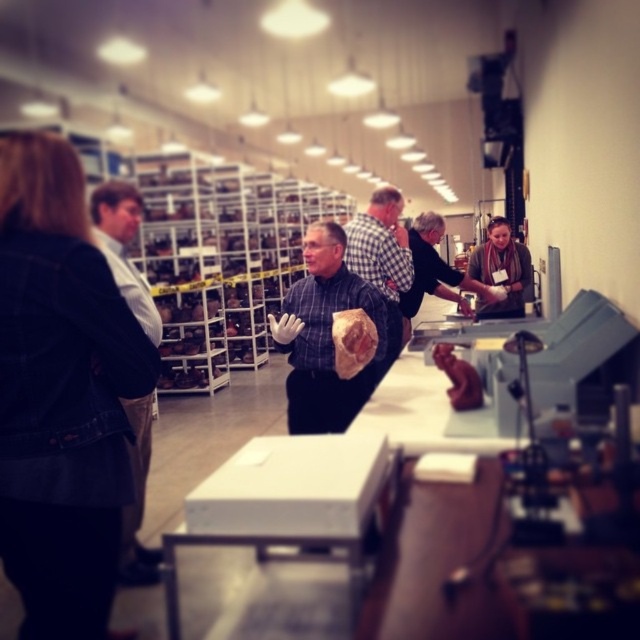
Is matte black shirt at center below brown wool scarf at upper right?

Correct, matte black shirt at center is located below brown wool scarf at upper right.

Does matte black shirt at center lie in front of brown wool scarf at upper right?

Yes, it is.

Find the location of a particular element. The height and width of the screenshot is (640, 640). matte black shirt at center is located at coordinates (436, 269).

Does denim jacket at left lie in front of matte brown paper bag at center?

Yes.

Which is below, denim jacket at left or matte brown paper bag at center?

denim jacket at left is below.

You are a GUI agent. You are given a task and a screenshot of the screen. Output one action in this format:
    pyautogui.click(x=<x>, y=<y>)
    Task: Click on the denim jacket at left
    The width and height of the screenshot is (640, 640).
    Given the screenshot: What is the action you would take?
    pyautogui.click(x=61, y=394)

The width and height of the screenshot is (640, 640). I want to click on denim jacket at left, so click(x=61, y=394).

Does matte brown paper bag at center appear under white shirt at left?

No, matte brown paper bag at center is not below white shirt at left.

Find the location of a particular element. matte brown paper bag at center is located at coordinates (324, 336).

Where is `matte brown paper bag at center`? The height and width of the screenshot is (640, 640). matte brown paper bag at center is located at coordinates (324, 336).